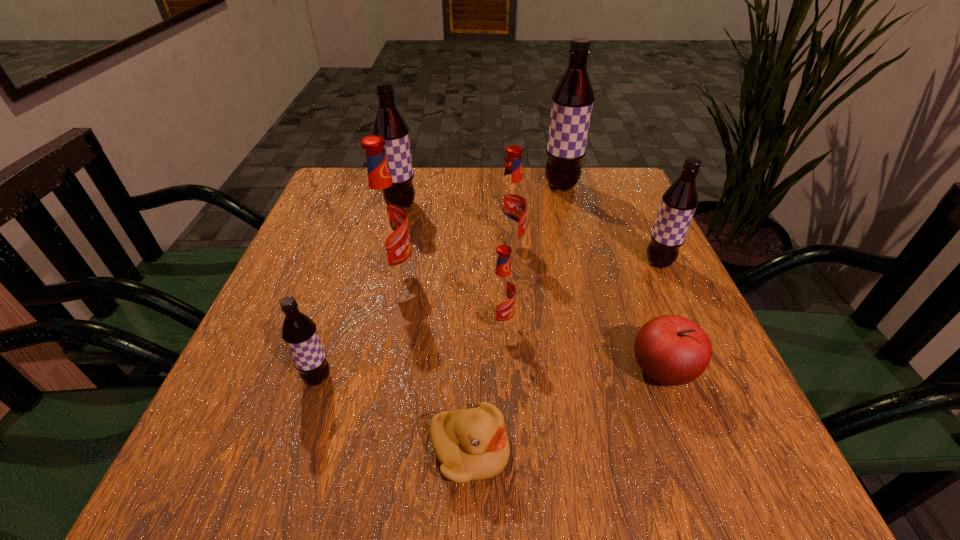
The width and height of the screenshot is (960, 540). In order to click on free space located on the front of the second smallest red root beer in this screenshot , I will do `click(515, 309)`.

Where is `vacant space located on the front of the rightmost brown root beer`? The height and width of the screenshot is (540, 960). vacant space located on the front of the rightmost brown root beer is located at coordinates (676, 299).

Where is `vacant space situated 0.150m on the left of the nearest red root beer`? This screenshot has width=960, height=540. vacant space situated 0.150m on the left of the nearest red root beer is located at coordinates (406, 325).

Locate an element on the screen. The height and width of the screenshot is (540, 960). vacant space situated 0.150m on the front of the nearest brown root beer is located at coordinates (283, 485).

The height and width of the screenshot is (540, 960). In order to click on free point located 0.350m on the back of the apple in this screenshot , I will do `click(610, 230)`.

Locate an element on the screen. The image size is (960, 540). free spot located 0.200m on the beak of the shortest object is located at coordinates (648, 451).

Identify the location of object located at the near edge. This screenshot has height=540, width=960. (471, 444).

Find the location of `object at the left edge`. object at the left edge is located at coordinates click(299, 332).

Where is `apple that is at the right edge`? The height and width of the screenshot is (540, 960). apple that is at the right edge is located at coordinates (672, 350).

You are a GUI agent. You are given a task and a screenshot of the screen. Output one action in this format:
    pyautogui.click(x=<x>, y=<y>)
    Task: Click on the object that is at the far right corner
    The height and width of the screenshot is (540, 960).
    Given the screenshot: What is the action you would take?
    pyautogui.click(x=572, y=100)